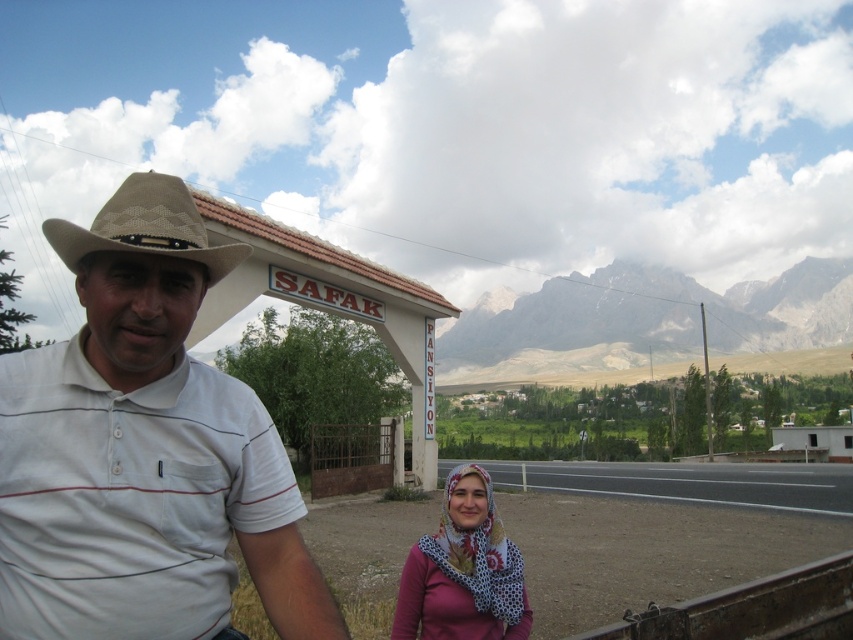
Question: Among these points, which one is farthest from the camera?

Choices:
 (A) (222, 452)
 (B) (161, 236)

Answer: (A)

Question: Which object is positioned closest to the tan woven cowboy hat at left?

Choices:
 (A) printed cotton scarf at lower center
 (B) white matte shirt at center

Answer: (B)

Question: Is white matte shirt at center thinner than rugged stone mountain at upper center?

Choices:
 (A) yes
 (B) no

Answer: (A)

Question: Does rugged stone mountain at upper center have a greater width compared to printed cotton scarf at lower center?

Choices:
 (A) yes
 (B) no

Answer: (A)

Question: Among these objects, which one is nearest to the camera?

Choices:
 (A) white matte shirt at center
 (B) rugged stone mountain at upper center

Answer: (A)

Question: Is rugged stone mountain at upper center below printed cotton scarf at lower center?

Choices:
 (A) yes
 (B) no

Answer: (B)